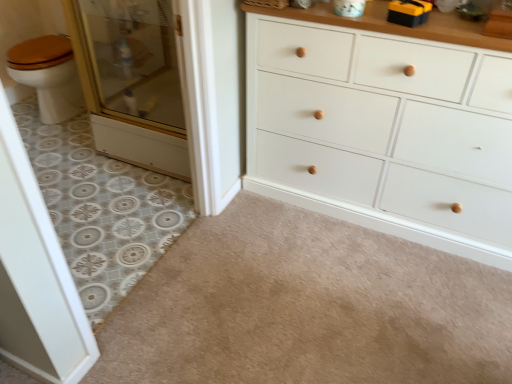
Question: Is clear glass screen door at left, marked as the 2th screen door in a top-to-bottom arrangement, placed right next to black plastic tool at upper right?

Choices:
 (A) yes
 (B) no

Answer: (B)

Question: From the image's perspective, is clear glass screen door at left, which is counted as the first screen door, starting from the bottom, located beneath black plastic tool at upper right?

Choices:
 (A) no
 (B) yes

Answer: (B)

Question: Can you confirm if clear glass screen door at left, which is counted as the first screen door, starting from the bottom, is wider than black plastic tool at upper right?

Choices:
 (A) yes
 (B) no

Answer: (B)

Question: Is clear glass screen door at left, acting as the 2th screen door starting from the back, far from black plastic tool at upper right?

Choices:
 (A) no
 (B) yes

Answer: (B)

Question: Considering the relative positions of clear glass screen door at left, which is counted as the first screen door, starting from the bottom, and black plastic tool at upper right in the image provided, is clear glass screen door at left, which is counted as the first screen door, starting from the bottom, in front of black plastic tool at upper right?

Choices:
 (A) no
 (B) yes

Answer: (B)

Question: Can you confirm if clear glass screen door at left, acting as the 2th screen door starting from the back, is positioned to the left of black plastic tool at upper right?

Choices:
 (A) no
 (B) yes

Answer: (B)

Question: From the image's perspective, does white painted wood chest of drawers at center appear higher than patterned tile floor at left, the first plain positioned from the left?

Choices:
 (A) no
 (B) yes

Answer: (B)

Question: Is white painted wood chest of drawers at center not within patterned tile floor at left, the first plain positioned from the left?

Choices:
 (A) no
 (B) yes

Answer: (B)

Question: Can you confirm if white painted wood chest of drawers at center is wider than patterned tile floor at left, the first plain positioned from the left?

Choices:
 (A) no
 (B) yes

Answer: (A)

Question: From a real-world perspective, does white painted wood chest of drawers at center stand above patterned tile floor at left, the first plain positioned from the left?

Choices:
 (A) yes
 (B) no

Answer: (A)

Question: Is white painted wood chest of drawers at center shorter than patterned tile floor at left, arranged as the second plain when viewed from the right?

Choices:
 (A) no
 (B) yes

Answer: (A)

Question: Does white painted wood chest of drawers at center have a larger size compared to patterned tile floor at left, arranged as the second plain when viewed from the right?

Choices:
 (A) yes
 (B) no

Answer: (A)

Question: Can you confirm if white painted wood chest of drawers at center is bigger than beige carpet at lower center, positioned as the first plain in right-to-left order?

Choices:
 (A) yes
 (B) no

Answer: (A)